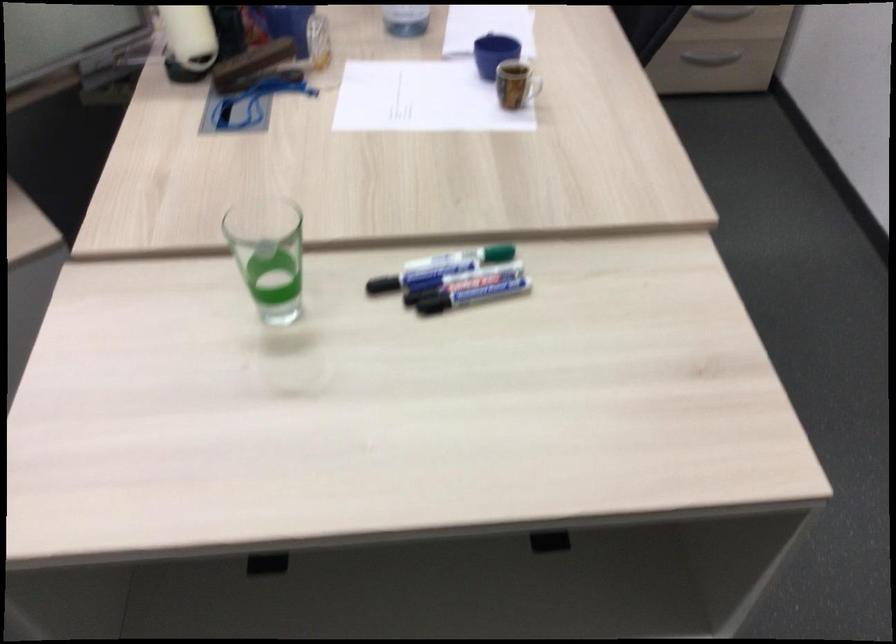
Locate an element on the screen. The width and height of the screenshot is (896, 644). glass with green band is located at coordinates pyautogui.click(x=268, y=254).